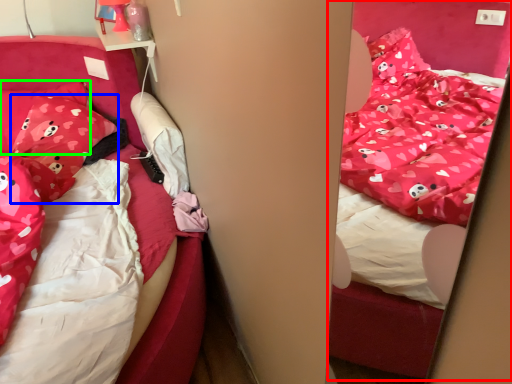
Question: Considering the real-world distances, which object is farthest from bed (highlighted by a red box)? pillow (highlighted by a blue box) or pillow (highlighted by a green box)?

Choices:
 (A) pillow
 (B) pillow

Answer: (B)